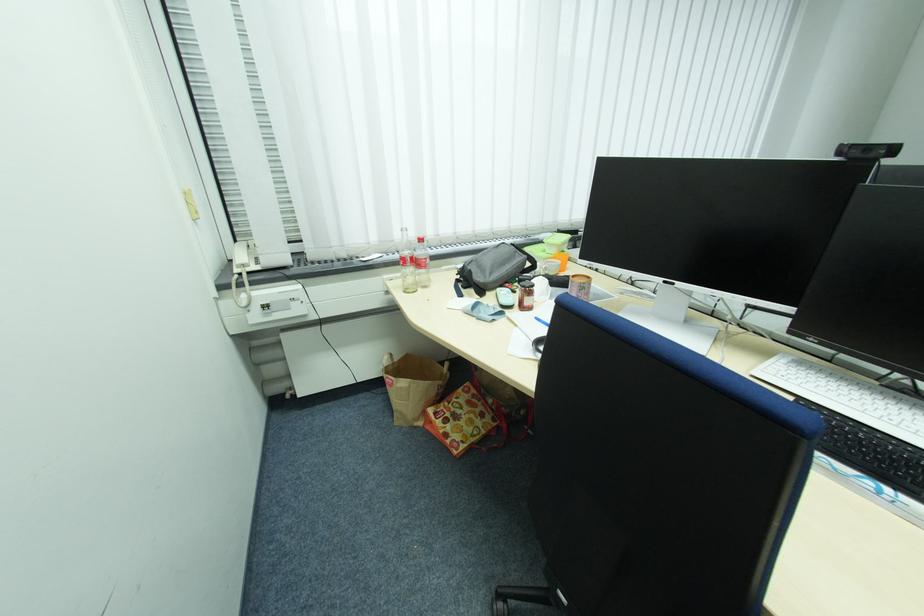
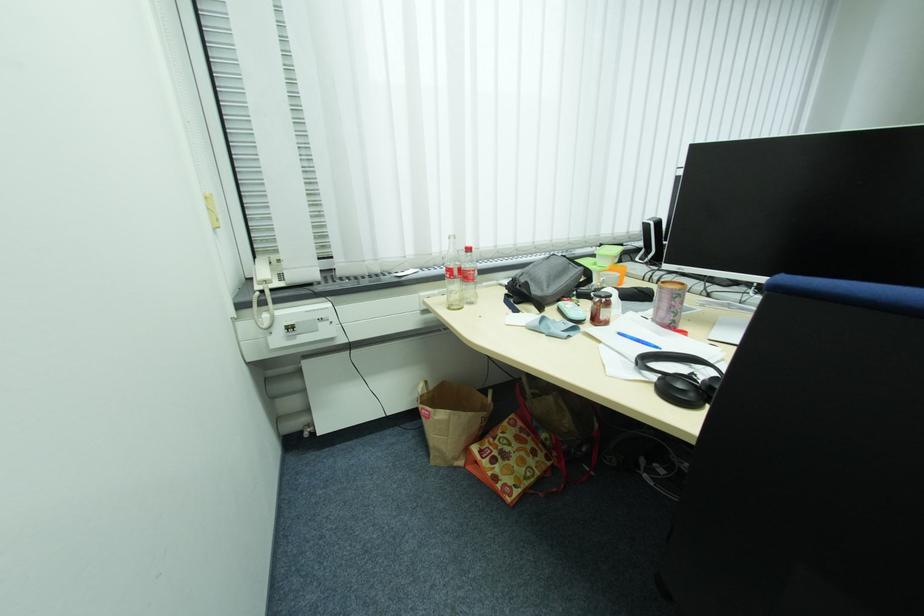
Question: The first image is from the beginning of the video and the second image is from the end. How did the camera likely rotate when shooting the video?

Choices:
 (A) Left
 (B) Right
 (C) Up
 (D) Down

Answer: (C)